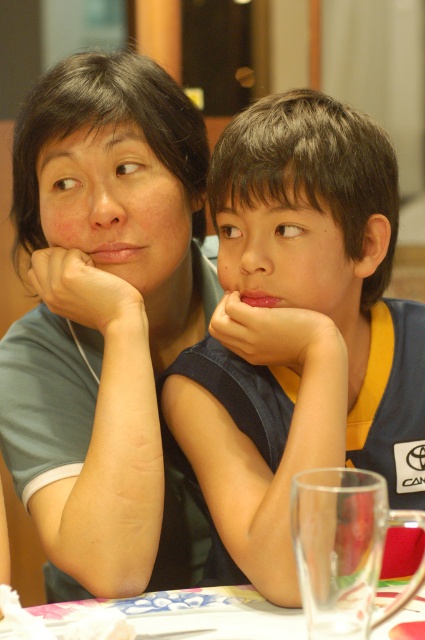
Question: Among these points, which one is farthest from the camera?

Choices:
 (A) (414, 628)
 (B) (232, 305)
 (C) (50, 305)

Answer: (C)

Question: Which is farther from the matte gray shirt at left?

Choices:
 (A) dark blue jersey at center
 (B) floral-patterned tablecloth at lower center

Answer: (B)

Question: Where is dark blue jersey at center located in relation to floral-patterned tablecloth at lower center in the image?

Choices:
 (A) left
 (B) right

Answer: (B)

Question: Can you confirm if matte gray shirt at left is bigger than floral-patterned tablecloth at lower center?

Choices:
 (A) yes
 (B) no

Answer: (A)

Question: Is matte gray shirt at left above floral-patterned tablecloth at lower center?

Choices:
 (A) yes
 (B) no

Answer: (A)

Question: Estimate the real-world distances between objects in this image. Which object is farther from the dark blue jersey at center?

Choices:
 (A) matte gray shirt at left
 (B) floral-patterned tablecloth at lower center

Answer: (B)